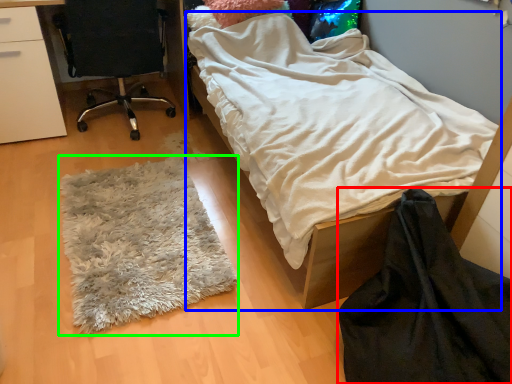
Question: Estimate the real-world distances between objects in this image. Which object is farther from blanket (highlighted by a red box), bed (highlighted by a blue box) or mat (highlighted by a green box)?

Choices:
 (A) bed
 (B) mat

Answer: (B)